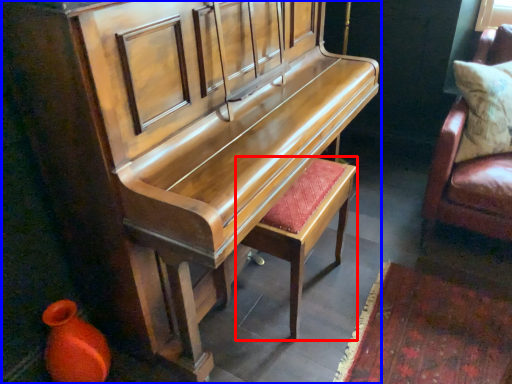
Question: Which point is closer to the camera, stool (highlighted by a red box) or furniture (highlighted by a blue box)?

Choices:
 (A) stool
 (B) furniture

Answer: (B)